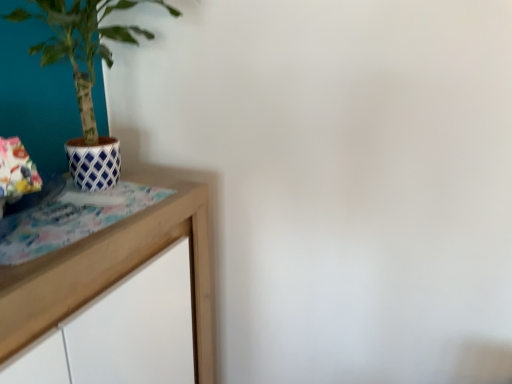
Identify the location of free space above wooden table at left (from a real-world perspective). (85, 211).